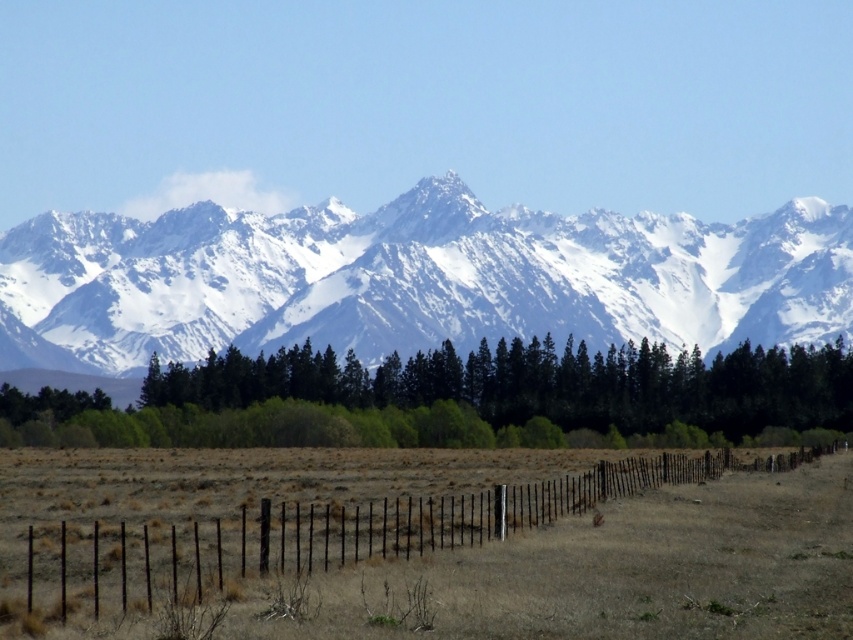
Is black wire fence at lower center shorter than green leafy trees at center?

Yes.

Is point (636, 580) positioned before point (305, 340)?

Yes, point (636, 580) is in front of point (305, 340).

The image size is (853, 640). What are the coordinates of `black wire fence at lower center` in the screenshot? It's located at (434, 557).

Image resolution: width=853 pixels, height=640 pixels. Identify the location of black wire fence at lower center. (434, 557).

Who is positioned more to the right, snowy granite mountain range at upper center or black wire fence at lower center?

black wire fence at lower center is more to the right.

Could you measure the distance between snowy granite mountain range at upper center and black wire fence at lower center?

A distance of 205.78 meters exists between snowy granite mountain range at upper center and black wire fence at lower center.

Does point (7, 316) come behind point (544, 611)?

Yes, point (7, 316) is behind point (544, 611).

Locate an element on the screen. snowy granite mountain range at upper center is located at coordinates (412, 280).

Is snowy granite mountain range at upper center further to the viewer compared to green leafy trees at center?

Yes, it is.

Between snowy granite mountain range at upper center and green leafy trees at center, which one has more height?

With more height is snowy granite mountain range at upper center.

Between point (799, 317) and point (500, 342), which one is positioned in front?

Point (500, 342) is more forward.

Where is `snowy granite mountain range at upper center`? snowy granite mountain range at upper center is located at coordinates (412, 280).